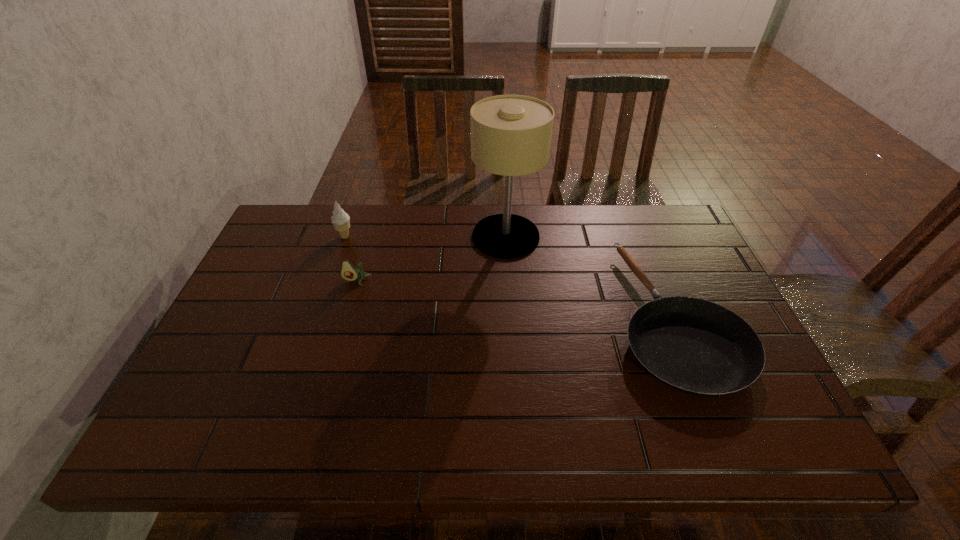
Identify the location of table lamp. (511, 135).

Where is `the tallest object`? The width and height of the screenshot is (960, 540). the tallest object is located at coordinates (511, 135).

Locate an element on the screen. the leftmost object is located at coordinates (341, 221).

At what (x,y) coordinates should I click in order to perform the action: click on icecream. Please return your answer as a coordinate pair (x, y). Looking at the image, I should click on (341, 221).

Find the location of a particular element. avocado is located at coordinates (348, 272).

Locate an element on the screen. the second shortest object is located at coordinates (348, 272).

In order to click on the shortest object in this screenshot , I will do `click(698, 347)`.

At what (x,y) coordinates should I click in order to perform the action: click on the rightmost object. Please return your answer as a coordinate pair (x, y). The height and width of the screenshot is (540, 960). Looking at the image, I should click on (698, 347).

At what (x,y) coordinates should I click in order to perform the action: click on vacant region located 0.050m on the left of the second object from right to left. Please return your answer as a coordinate pair (x, y). This screenshot has height=540, width=960. Looking at the image, I should click on (456, 237).

Find the location of a particular element. free space located 0.050m on the front-facing side of the leftmost object is located at coordinates (370, 237).